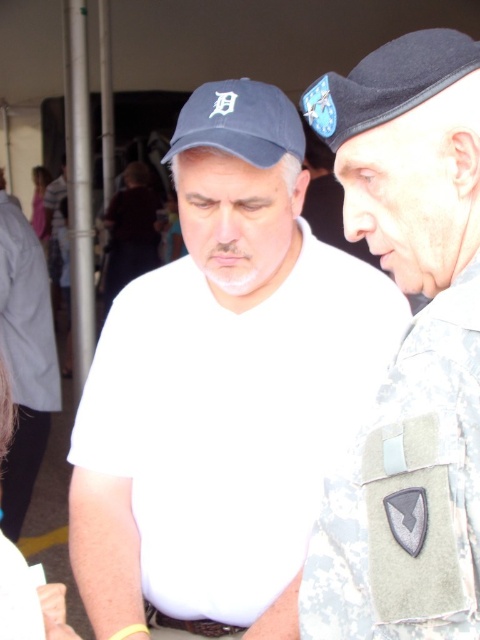
Question: Which point is closer to the camera taking this photo?

Choices:
 (A) (212, 99)
 (B) (313, 252)

Answer: (A)

Question: Can you confirm if black felt baseball cap at upper center is positioned above light pink fabric at upper left?

Choices:
 (A) yes
 (B) no

Answer: (B)

Question: In this image, where is white matte shirt at center located relative to matte blue baseball cap at center?

Choices:
 (A) right
 (B) left

Answer: (B)

Question: Which object is closer to the camera taking this photo?

Choices:
 (A) white matte shirt at center
 (B) light pink fabric at upper left
 (C) matte blue baseball cap at center

Answer: (A)

Question: Which point appears farthest from the camera in this image?

Choices:
 (A) (19, 385)
 (B) (271, 134)
 (C) (43, 189)
 (D) (348, 284)

Answer: (C)

Question: Does white matte shirt at center appear on the left side of black felt baseball cap at upper center?

Choices:
 (A) yes
 (B) no

Answer: (A)